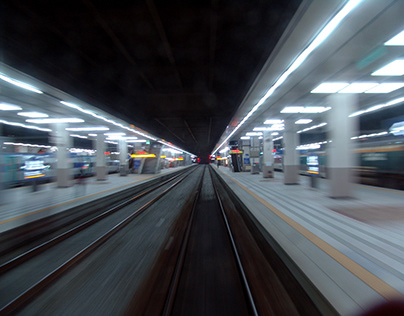
Find the location of a particular element. beige part of column is located at coordinates (338, 183), (291, 174), (265, 172), (255, 171), (121, 171), (98, 174), (59, 179).